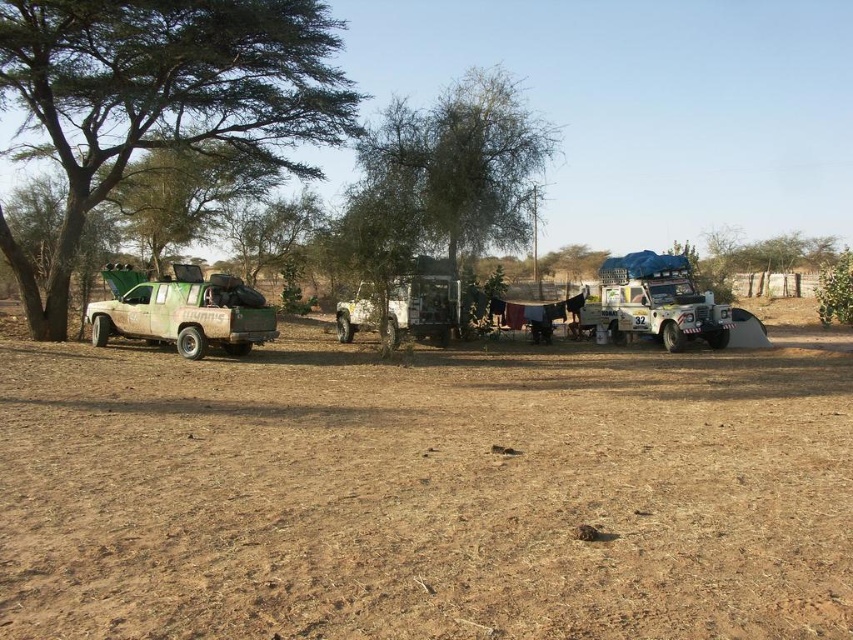
Question: Is green leafy tree at left thinner than green camouflage truck at left?

Choices:
 (A) no
 (B) yes

Answer: (A)

Question: Which object is closer to the camera taking this photo?

Choices:
 (A) green leafy tree at left
 (B) green leafy tree at center
 (C) blue tarpaulin jeep at center
 (D) metallic silver jeep at center

Answer: (A)

Question: Is brown dry soil at center to the left of green camouflage truck at left from the viewer's perspective?

Choices:
 (A) no
 (B) yes

Answer: (A)

Question: Can you confirm if brown dry soil at center is positioned above blue tarpaulin jeep at center?

Choices:
 (A) no
 (B) yes

Answer: (A)

Question: Which object is closer to the camera taking this photo?

Choices:
 (A) green camouflage truck at left
 (B) metallic silver jeep at center

Answer: (A)

Question: Which point is closer to the camera?

Choices:
 (A) (426, 332)
 (B) (310, 88)
 (C) (384, 273)
 (D) (788, 566)

Answer: (D)